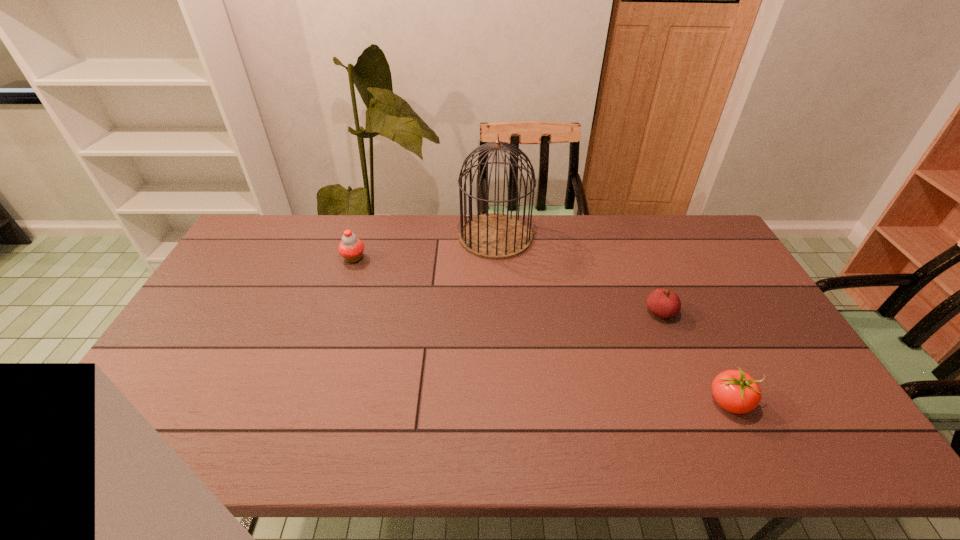
Find the location of `free space between the tallest object and the farther tomato`. free space between the tallest object and the farther tomato is located at coordinates (578, 274).

Where is `vacant area between the nearer tomato and the third object from right to left`? This screenshot has width=960, height=540. vacant area between the nearer tomato and the third object from right to left is located at coordinates (612, 319).

Locate an element on the screen. free point between the nearer tomato and the third farthest object is located at coordinates (695, 357).

I want to click on empty space between the second nearest object and the tallest object, so click(x=578, y=274).

Where is `free space between the tallest object and the farther tomato`? The width and height of the screenshot is (960, 540). free space between the tallest object and the farther tomato is located at coordinates (578, 274).

Locate an element on the screen. The height and width of the screenshot is (540, 960). vacant space that's between the second nearest object and the nearer tomato is located at coordinates (695, 357).

Identify the location of free spot between the birdcage and the nearer tomato. This screenshot has height=540, width=960. (612, 319).

Where is `free space between the cupcake and the farther tomato`? The width and height of the screenshot is (960, 540). free space between the cupcake and the farther tomato is located at coordinates (507, 285).

Identify which object is the second nearest to the leftmost object. Please provide its 2D coordinates. Your answer should be formatted as a tuple, i.e. [(x, y)], where the tuple contains the x and y coordinates of a point satisfying the conditions above.

[(663, 303)]

Image resolution: width=960 pixels, height=540 pixels. I want to click on object that ranks as the second closest to the second nearest object, so click(495, 236).